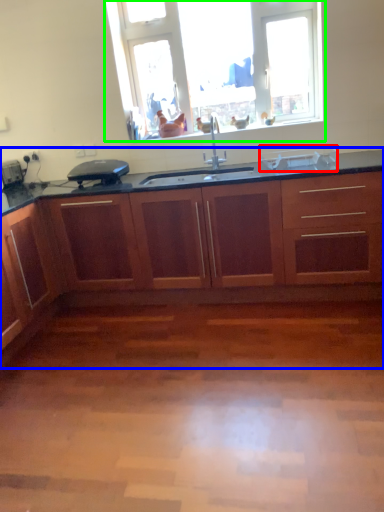
Question: Based on their relative distances, which object is nearer to appliance (highlighted by a red box)? Choose from cabinetry (highlighted by a blue box) and window (highlighted by a green box).

Choices:
 (A) cabinetry
 (B) window

Answer: (B)